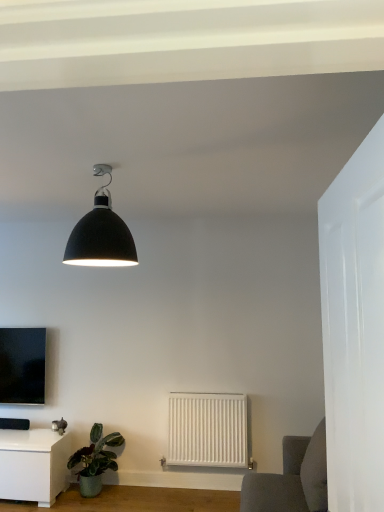
Question: Is white matte radiator at center in front of or behind white glossy door at right in the image?

Choices:
 (A) front
 (B) behind

Answer: (B)

Question: Is point (226, 419) closer or farther from the camera than point (331, 242)?

Choices:
 (A) farther
 (B) closer

Answer: (A)

Question: Considering the real-world distances, which object is closest to the matte black lampshade at upper center?

Choices:
 (A) green matte plant at lower left
 (B) white glossy table at lower left
 (C) matte black tv at left
 (D) white matte radiator at center
 (E) white glossy door at right

Answer: (E)

Question: Which object is the farthest from the white matte radiator at center?

Choices:
 (A) white glossy table at lower left
 (B) matte black lampshade at upper center
 (C) green matte plant at lower left
 (D) matte black tv at left
 (E) white glossy door at right

Answer: (E)